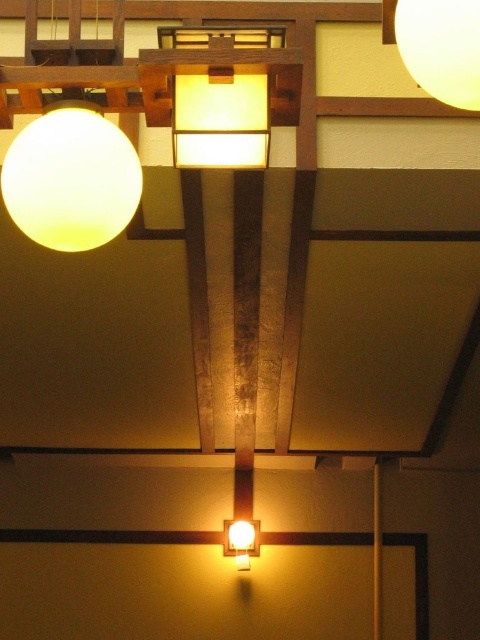
You are an interior designer assessing the ceiling design. You need to determine which object is taller between the matte wood panel at upper center and the matte white sphere at upper right. Based on the scene, which one is taller?

The matte white sphere at upper right is taller than the matte wood panel at upper center according to the description.

You are standing in the room and looking at the ceiling. There are two points marked on the ceiling, one at point (x=48, y=164) and the other at point (x=251, y=545). Which point is closer to you?

Point (x=48, y=164) is in front of point (x=251, y=545), so it is closer to you.

You are an interior designer planning to add a new light fixture between the matte wood panel at upper center and the matte white sphere at upper right. Based on their current positions, where should you place the new fixture to maintain symmetry between the two existing objects?

To maintain symmetry between the matte wood panel at upper center and the matte white sphere at upper right, the new fixture should be placed in the center between them since the matte wood panel at upper center is positioned on the left side of matte white sphere at upper right.